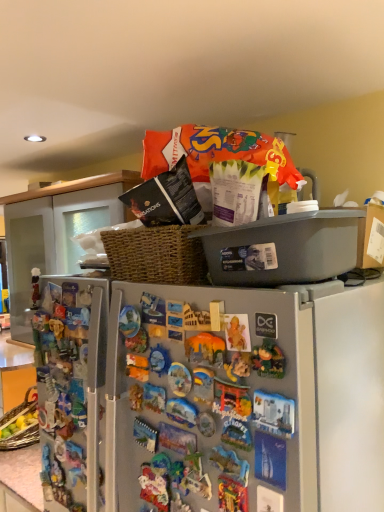
Question: In terms of size, does matte plastic figurine at left, positioned as the 1th toy in back-to-front order, appear bigger or smaller than metallic gray refrigerator at center?

Choices:
 (A) small
 (B) big

Answer: (A)

Question: Considering the positions of matte plastic figurine at left, arranged as the 2th toy when viewed from the right, and metallic gray refrigerator at center in the image, is matte plastic figurine at left, arranged as the 2th toy when viewed from the right, taller or shorter than metallic gray refrigerator at center?

Choices:
 (A) tall
 (B) short

Answer: (B)

Question: Considering the real-world distances, which object is farthest from the matte plastic figurine at left, arranged as the 2th toy when viewed from the right?

Choices:
 (A) matte orange toy at center, which is the 2th toy in back-to-front order
 (B) metallic gray refrigerator at center

Answer: (A)

Question: Estimate the real-world distances between objects in this image. Which object is closer to the metallic gray refrigerator at center?

Choices:
 (A) matte plastic figurine at left, the 1th toy when ordered from left to right
 (B) matte orange toy at center, the 2th toy positioned from the left

Answer: (B)